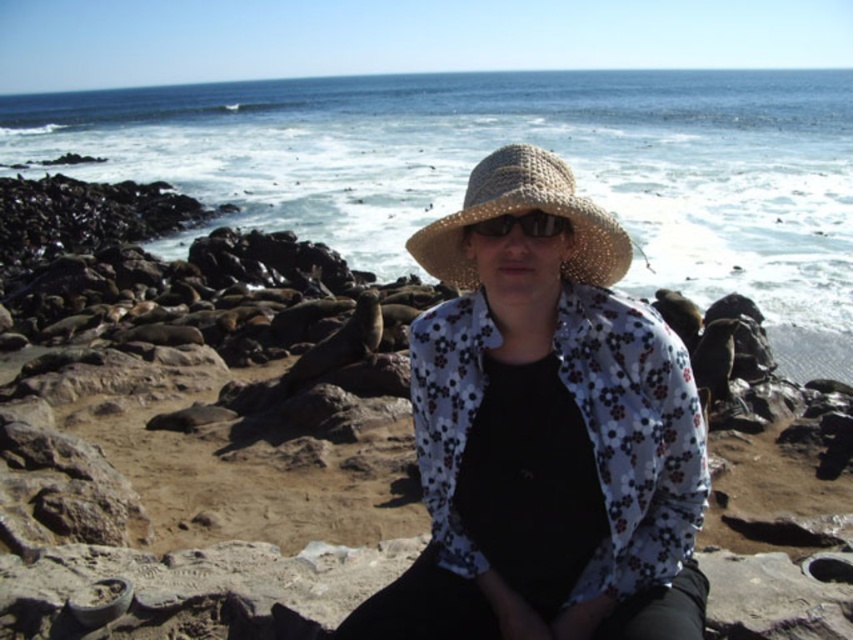
Does clear blue water at upper center come in front of shiny metallic sunglasses at center?

No.

Who is shorter, clear blue water at upper center or shiny metallic sunglasses at center?

Standing shorter between the two is shiny metallic sunglasses at center.

Is point (787, 209) positioned after point (503, 216)?

That is True.

Where is `clear blue water at upper center`? The width and height of the screenshot is (853, 640). clear blue water at upper center is located at coordinates (498, 145).

Where is `woven straw hat at center`? Image resolution: width=853 pixels, height=640 pixels. woven straw hat at center is located at coordinates (544, 433).

Does woven straw hat at center have a lesser width compared to shiny metallic sunglasses at center?

In fact, woven straw hat at center might be wider than shiny metallic sunglasses at center.

Measure the distance between woven straw hat at center and camera.

They are 7.72 feet apart.

At what (x,y) coordinates should I click in order to perform the action: click on woven straw hat at center. Please return your answer as a coordinate pair (x, y). This screenshot has width=853, height=640. Looking at the image, I should click on (544, 433).

Does straw hat at center have a lesser height compared to shiny metallic sunglasses at center?

Incorrect, straw hat at center's height does not fall short of shiny metallic sunglasses at center's.

Which of these two, straw hat at center or shiny metallic sunglasses at center, stands taller?

Standing taller between the two is straw hat at center.

Is point (577, 262) positioned after point (480, 228)?

Yes, it is behind point (480, 228).

The image size is (853, 640). Find the location of `straw hat at center`. straw hat at center is located at coordinates (521, 212).